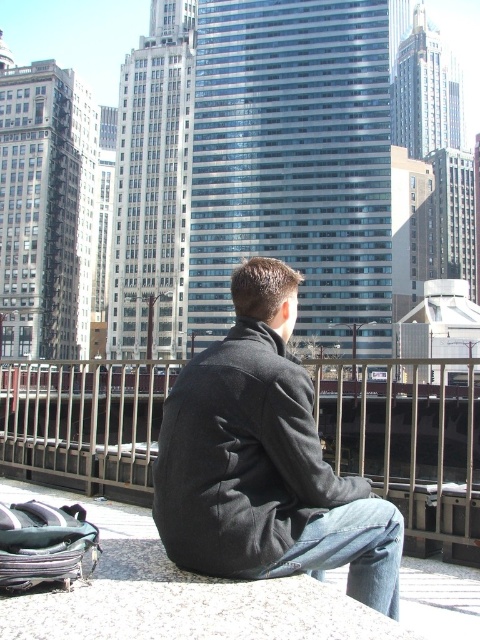
Question: Which of the following is the farthest from the observer?

Choices:
 (A) metallic silver rail at center
 (B) dark gray wool coat at center
 (C) denim at lower right

Answer: (A)

Question: Considering the real-world distances, which object is farthest from the dark gray wool coat at center?

Choices:
 (A) metallic silver rail at center
 (B) denim at lower right

Answer: (A)

Question: Among these points, which one is farthest from the camera?

Choices:
 (A) (249, 412)
 (B) (383, 564)

Answer: (A)

Question: Does metallic silver rail at center come in front of denim at lower right?

Choices:
 (A) yes
 (B) no

Answer: (B)

Question: Does dark gray wool coat at center have a greater width compared to metallic silver rail at center?

Choices:
 (A) yes
 (B) no

Answer: (B)

Question: Can you confirm if dark gray wool coat at center is positioned below metallic silver rail at center?

Choices:
 (A) yes
 (B) no

Answer: (B)